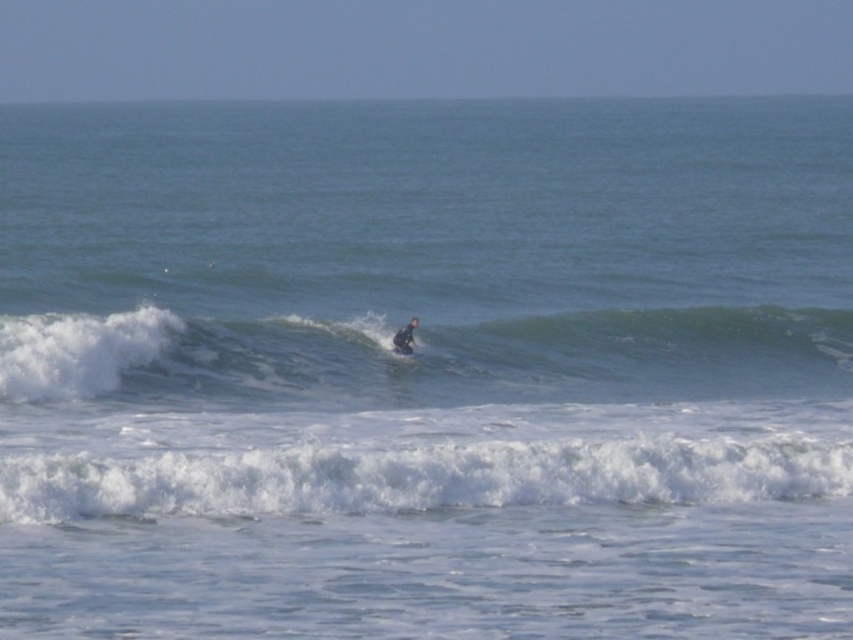
Question: Which of the following is the closest to the observer?

Choices:
 (A) (222, 513)
 (B) (801, 352)
 (C) (392, 349)
 (D) (399, 348)

Answer: (A)

Question: From the image, what is the correct spatial relationship of green rubber surfboard at center in relation to blue wetsuit surfer at center?

Choices:
 (A) left
 (B) right

Answer: (B)

Question: Estimate the real-world distances between objects in this image. Which object is farther from the green rubber surfboard at center?

Choices:
 (A) blue wetsuit surfer at center
 (B) white foamy wave at lower center
 (C) blue foam surfboard at center

Answer: (B)

Question: Is blue wetsuit surfer at center smaller than blue foam surfboard at center?

Choices:
 (A) yes
 (B) no

Answer: (B)

Question: Is green rubber surfboard at center positioned before white foamy wave at lower center?

Choices:
 (A) yes
 (B) no

Answer: (B)

Question: Among these objects, which one is farthest from the camera?

Choices:
 (A) white foamy wave at lower center
 (B) blue wetsuit surfer at center

Answer: (B)